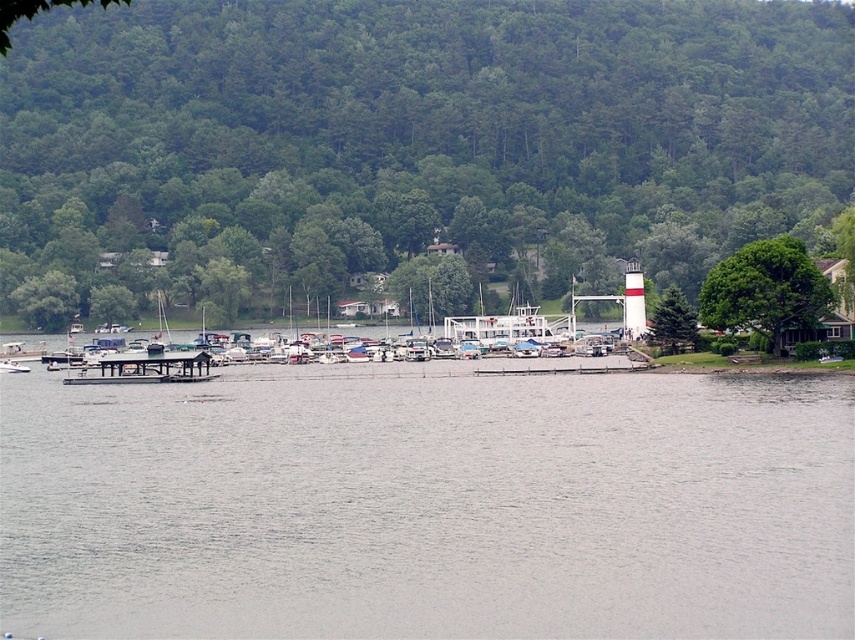
Who is positioned more to the left, gray water at center or wooden dock at center?

wooden dock at center

Who is higher up, gray water at center or wooden dock at center?

wooden dock at center is higher up.

Identify the location of gray water at center. This screenshot has width=855, height=640. (426, 506).